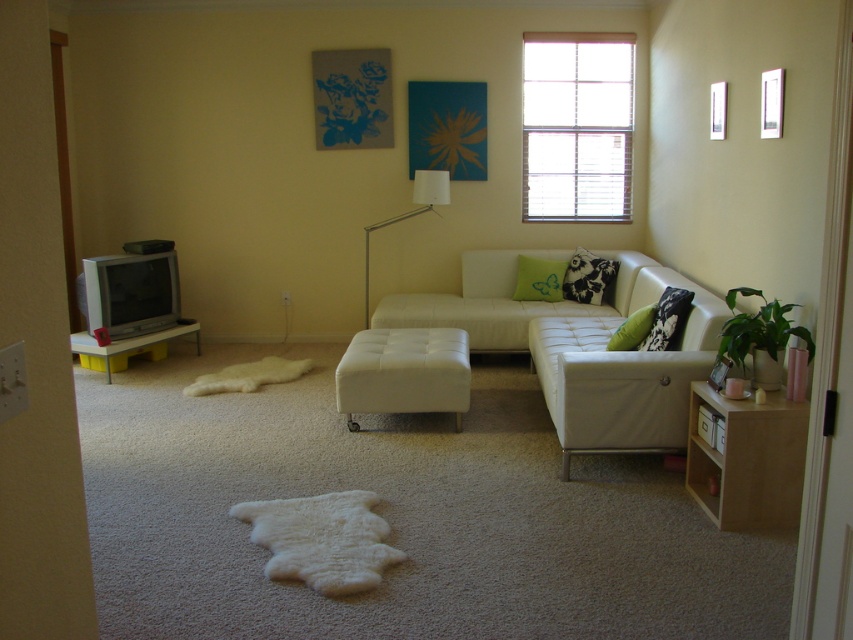
You are a delivery person who just arrived at the house. You need to place a package on the floor between the white leather couch at center and the black printed pillow at center. The package is 18 inches long. Can you fit the package between them without moving either object?

The distance between the white leather couch at center and the black printed pillow at center is 19.08 inches. Since the package is 18 inches long, it can fit between them as there is enough space.

Looking at this image, you are arranging a small table between the white leather couch at center and the black printed pillow at center. Which object should the table be placed closer to if you want the table to be closer to the wider object?

The white leather couch at center is wider than the black printed pillow at center. Therefore, the table should be placed closer to the white leather couch at center.